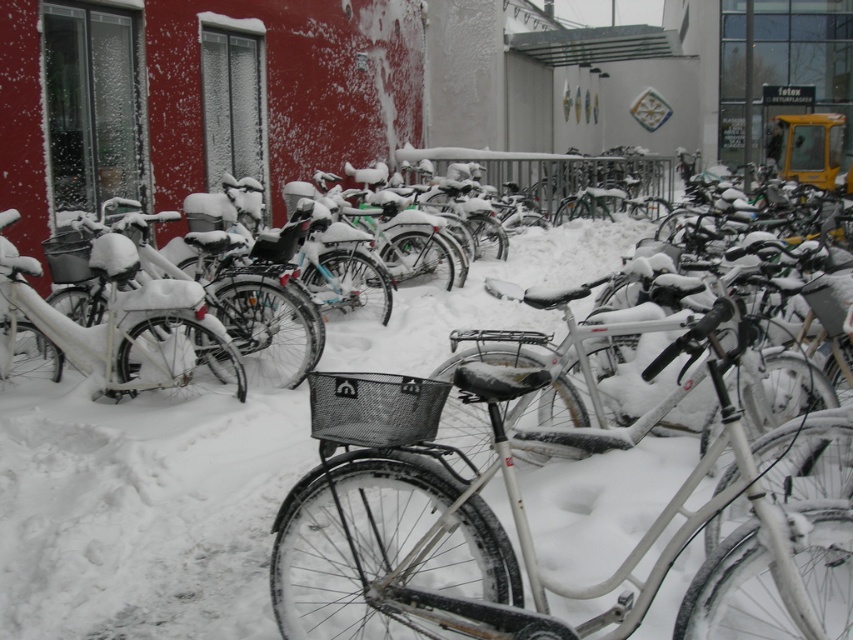
Can you confirm if white matte bicycle at center is positioned to the left of white matte bicycle at left?

No, white matte bicycle at center is not to the left of white matte bicycle at left.

Measure the distance from white matte bicycle at center to white matte bicycle at left.

They are 9.05 feet apart.

Is point (424, 616) closer to camera compared to point (140, 380)?

Yes, it is.

The width and height of the screenshot is (853, 640). Identify the location of white matte bicycle at center. (515, 529).